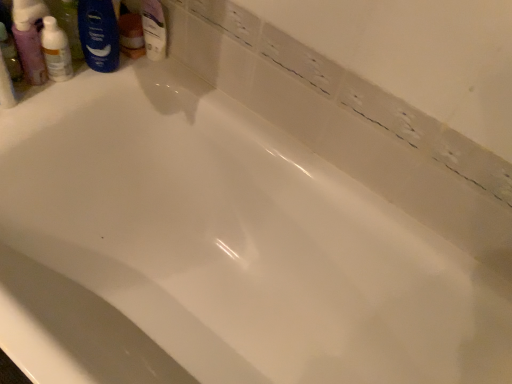
Question: Is translucent plastic mouthwash at upper left facing away from blue matte shaving cream at upper left?

Choices:
 (A) yes
 (B) no

Answer: (B)

Question: Is translucent plastic mouthwash at upper left taller than blue matte shaving cream at upper left?

Choices:
 (A) no
 (B) yes

Answer: (A)

Question: Is translucent plastic mouthwash at upper left further to the viewer compared to blue matte shaving cream at upper left?

Choices:
 (A) yes
 (B) no

Answer: (B)

Question: Is translucent plastic mouthwash at upper left at the right side of blue matte shaving cream at upper left?

Choices:
 (A) no
 (B) yes

Answer: (A)

Question: From a real-world perspective, is translucent plastic mouthwash at upper left positioned over blue matte shaving cream at upper left based on gravity?

Choices:
 (A) no
 (B) yes

Answer: (A)

Question: Would you consider translucent plastic mouthwash at upper left to be distant from blue matte shaving cream at upper left?

Choices:
 (A) yes
 (B) no

Answer: (B)

Question: Is blue matte shaving cream at upper left closer to the viewer compared to translucent plastic bottle at upper left?

Choices:
 (A) yes
 (B) no

Answer: (B)

Question: From the image's perspective, is blue matte shaving cream at upper left on translucent plastic bottle at upper left?

Choices:
 (A) no
 (B) yes

Answer: (B)

Question: Is translucent plastic bottle at upper left at the back of blue matte shaving cream at upper left?

Choices:
 (A) no
 (B) yes

Answer: (A)

Question: Does blue matte shaving cream at upper left have a greater height compared to translucent plastic bottle at upper left?

Choices:
 (A) no
 (B) yes

Answer: (B)

Question: From a real-world perspective, is blue matte shaving cream at upper left beneath translucent plastic bottle at upper left?

Choices:
 (A) yes
 (B) no

Answer: (B)

Question: Considering the relative sizes of blue matte shaving cream at upper left and translucent plastic bottle at upper left in the image provided, is blue matte shaving cream at upper left bigger than translucent plastic bottle at upper left?

Choices:
 (A) no
 (B) yes

Answer: (B)

Question: Is translucent plastic mouthwash at upper left oriented towards translucent plastic bottle at upper left?

Choices:
 (A) no
 (B) yes

Answer: (A)